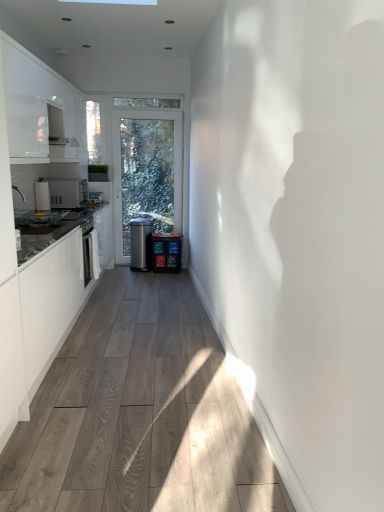
Describe the element at coordinates (140, 414) in the screenshot. The height and width of the screenshot is (512, 384). I see `wooden floor at center` at that location.

What are the coordinates of `matte plastic water cooler at center, which is the first water cooler in right-to-left order` in the screenshot? It's located at (166, 252).

Locate an element on the screen. clear glass window screen at upper left is located at coordinates (93, 132).

I want to click on white glossy countertop at left, so click(x=51, y=302).

This screenshot has height=512, width=384. Identify the location of satin silver microwave at left. (67, 192).

What are the coordinates of `wooden floor at center` in the screenshot? It's located at (140, 414).

Which water cooler is the 1st one when counting from the back of the satin silver microwave at left? Please provide its 2D coordinates.

[(166, 252)]

Is matte plastic water cooler at center, the second water cooler in the left-to-right sequence, thinner than satin silver microwave at left?

Yes.

From the picture: From the image's perspective, which one is positioned lower, matte plastic water cooler at center, which is the first water cooler in right-to-left order, or satin silver microwave at left?

matte plastic water cooler at center, which is the first water cooler in right-to-left order, is shown below in the image.

Between point (163, 270) and point (62, 194), which one is positioned behind?

Positioned behind is point (163, 270).

Is white glossy countertop at left oriented away from white glossy cabinet at upper left?

That's not correct — white glossy countertop at left is not looking away from white glossy cabinet at upper left.

Based on the photo, from a real-world perspective, does white glossy countertop at left sit lower than white glossy cabinet at upper left?

Correct, in the physical world, white glossy countertop at left is lower than white glossy cabinet at upper left.

Which point is more forward, (61, 291) or (59, 81)?

The point (61, 291) is more forward.

Who is smaller, white glossy countertop at left or white glossy cabinet at upper left?

white glossy cabinet at upper left is smaller.

Can you confirm if wooden floor at center is smaller than satin silver water cooler at center, positioned as the 2th water cooler in right-to-left order?

No, wooden floor at center is not smaller than satin silver water cooler at center, positioned as the 2th water cooler in right-to-left order.

Could you measure the distance between wooden floor at center and satin silver water cooler at center, positioned as the 2th water cooler in right-to-left order?

wooden floor at center is 7.67 feet away from satin silver water cooler at center, positioned as the 2th water cooler in right-to-left order.

Between wooden floor at center and satin silver water cooler at center, positioned as the 2th water cooler in right-to-left order, which one appears on the left side from the viewer's perspective?

From the viewer's perspective, satin silver water cooler at center, positioned as the 2th water cooler in right-to-left order, appears more on the left side.

Does wooden floor at center have a greater width compared to satin silver water cooler at center, positioned as the 2th water cooler in right-to-left order?

Correct, the width of wooden floor at center exceeds that of satin silver water cooler at center, positioned as the 2th water cooler in right-to-left order.

Relative to white glossy countertop at left, is matte plastic water cooler at center, the second water cooler in the left-to-right sequence, in front or behind?

matte plastic water cooler at center, the second water cooler in the left-to-right sequence, is positioned farther from the viewer than white glossy countertop at left.

Identify the location of the 1st water cooler behind the white glossy countertop at left, counting from the anchor's position. The image size is (384, 512). (166, 252).

Is there a large distance between matte plastic water cooler at center, the second water cooler in the left-to-right sequence, and white glossy countertop at left?

Absolutely, matte plastic water cooler at center, the second water cooler in the left-to-right sequence, is distant from white glossy countertop at left.

Is white glossy countertop at left at the back of matte plastic water cooler at center, the second water cooler in the left-to-right sequence?

No, matte plastic water cooler at center, the second water cooler in the left-to-right sequence, is not facing the opposite direction of white glossy countertop at left.

Who is smaller, satin silver water cooler at center, positioned as the 2th water cooler in right-to-left order, or clear glass window screen at upper left?

Smaller between the two is clear glass window screen at upper left.

Locate an element on the screen. Image resolution: width=384 pixels, height=512 pixels. window screen above the satin silver water cooler at center, positioned as the 2th water cooler in right-to-left order (from a real-world perspective) is located at coordinates (93, 132).

Between satin silver water cooler at center, positioned as the 2th water cooler in right-to-left order, and clear glass window screen at upper left, which one has larger width?

With larger width is satin silver water cooler at center, positioned as the 2th water cooler in right-to-left order.

Is point (132, 226) in front of point (98, 132)?

No, (132, 226) is behind (98, 132).

From a real-world perspective, is wooden floor at center beneath white glossy countertop at left?

Indeed, from a real-world perspective, wooden floor at center is positioned beneath white glossy countertop at left.

Which of these two, wooden floor at center or white glossy countertop at left, is wider?

With larger width is wooden floor at center.

Which is farther, (133,360) or (32,280)?

The point (133,360) is more distant.

In the scene shown: Which object is positioned more to the right, wooden floor at center or white glossy countertop at left?

Positioned to the right is wooden floor at center.

Which object is positioned more to the right, white glossy countertop at left or satin silver microwave at left?

Positioned to the right is white glossy countertop at left.

Considering the sizes of objects white glossy countertop at left and satin silver microwave at left in the image provided, who is taller, white glossy countertop at left or satin silver microwave at left?

white glossy countertop at left is taller.

Would you say satin silver microwave at left is part of white glossy countertop at left's contents?

No, satin silver microwave at left is not inside white glossy countertop at left.

Where is `the 2nd water cooler below the satin silver microwave at left (from a real-world perspective)`? The height and width of the screenshot is (512, 384). the 2nd water cooler below the satin silver microwave at left (from a real-world perspective) is located at coordinates (166, 252).

You are a GUI agent. You are given a task and a screenshot of the screen. Output one action in this format:
    pyautogui.click(x=<x>, y=<y>)
    Task: Click on the cabinetry that is above the white glossy countertop at left (from a real-world perspective)
    This screenshot has width=384, height=512.
    Given the screenshot: What is the action you would take?
    pyautogui.click(x=38, y=104)

Considering their positions, is white glossy countertop at left positioned further to clear glass window screen at upper left than wooden floor at center?

Among the two, wooden floor at center is located further to clear glass window screen at upper left.

Estimate the real-world distances between objects in this image. Which object is further from matte plastic water cooler at center, which is the first water cooler in right-to-left order, clear glass window screen at upper left or wooden floor at center?

wooden floor at center is further to matte plastic water cooler at center, which is the first water cooler in right-to-left order.

From the image, which object appears to be farther from matte plastic water cooler at center, which is the first water cooler in right-to-left order, wooden floor at center or satin silver water cooler at center, positioned as the 2th water cooler in right-to-left order?

Based on the image, wooden floor at center appears to be further to matte plastic water cooler at center, which is the first water cooler in right-to-left order.

Considering their positions, is white glossy cabinet at upper left positioned closer to white glossy countertop at left than satin silver water cooler at center, positioned as the 2th water cooler in right-to-left order?

white glossy cabinet at upper left is closer to white glossy countertop at left.

From the image, which object appears to be nearer to white glossy cabinet at upper left, clear glass window screen at upper left or white glossy countertop at left?

The object closer to white glossy cabinet at upper left is white glossy countertop at left.

Considering their positions, is white glossy countertop at left positioned further to matte plastic water cooler at center, the second water cooler in the left-to-right sequence, than satin silver microwave at left?

white glossy countertop at left is further to matte plastic water cooler at center, the second water cooler in the left-to-right sequence.

From the image, which object appears to be farther from wooden floor at center, clear glass window screen at upper left or white glossy cabinet at upper left?

Based on the image, clear glass window screen at upper left appears to be further to wooden floor at center.

In the scene shown: When comparing their distances from clear glass window screen at upper left, does satin silver water cooler at center, positioned as the 2th water cooler in right-to-left order, or matte plastic water cooler at center, which is the first water cooler in right-to-left order, seem closer?

satin silver water cooler at center, positioned as the 2th water cooler in right-to-left order, lies closer to clear glass window screen at upper left than the other object.

Locate an element on the screen. appliance between white glossy cabinet at upper left and matte plastic water cooler at center, which is the first water cooler in right-to-left order, along the z-axis is located at coordinates (67, 192).

Where is `appliance between clear glass window screen at upper left and satin silver water cooler at center, arranged as the 1th water cooler when viewed from the left, in the vertical direction`? This screenshot has width=384, height=512. appliance between clear glass window screen at upper left and satin silver water cooler at center, arranged as the 1th water cooler when viewed from the left, in the vertical direction is located at coordinates (67, 192).

Identify the location of cabinetry between wooden floor at center and clear glass window screen at upper left from front to back. (38, 104).

This screenshot has width=384, height=512. Find the location of `cabinetry positioned between white glossy countertop at left and satin silver water cooler at center, arranged as the 1th water cooler when viewed from the left, from near to far`. cabinetry positioned between white glossy countertop at left and satin silver water cooler at center, arranged as the 1th water cooler when viewed from the left, from near to far is located at coordinates (38, 104).